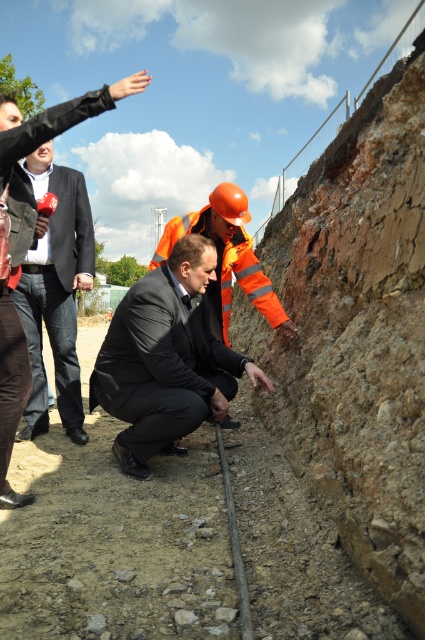
Question: Which is farther from the matte black suit at left?

Choices:
 (A) reflective orange safety vest at center
 (B) matte black suit at center

Answer: (A)

Question: Can you confirm if matte black suit at center is bigger than matte black suit at left?

Choices:
 (A) yes
 (B) no

Answer: (B)

Question: Does matte black suit at left appear on the left side of reflective orange safety vest at center?

Choices:
 (A) no
 (B) yes

Answer: (B)

Question: Based on their relative distances, which object is farther from the reflective orange safety vest at center?

Choices:
 (A) matte black suit at left
 (B) matte black suit at center

Answer: (A)

Question: Which object is positioned farthest from the matte black suit at left?

Choices:
 (A) reflective orange safety vest at center
 (B) matte black suit at center

Answer: (A)

Question: Does matte black suit at left appear on the right side of reflective orange safety vest at center?

Choices:
 (A) yes
 (B) no

Answer: (B)